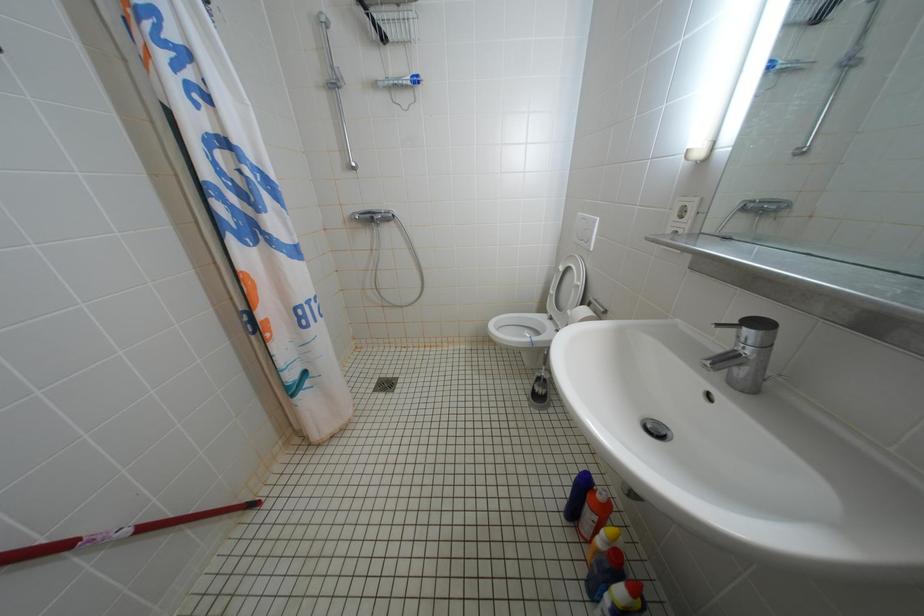
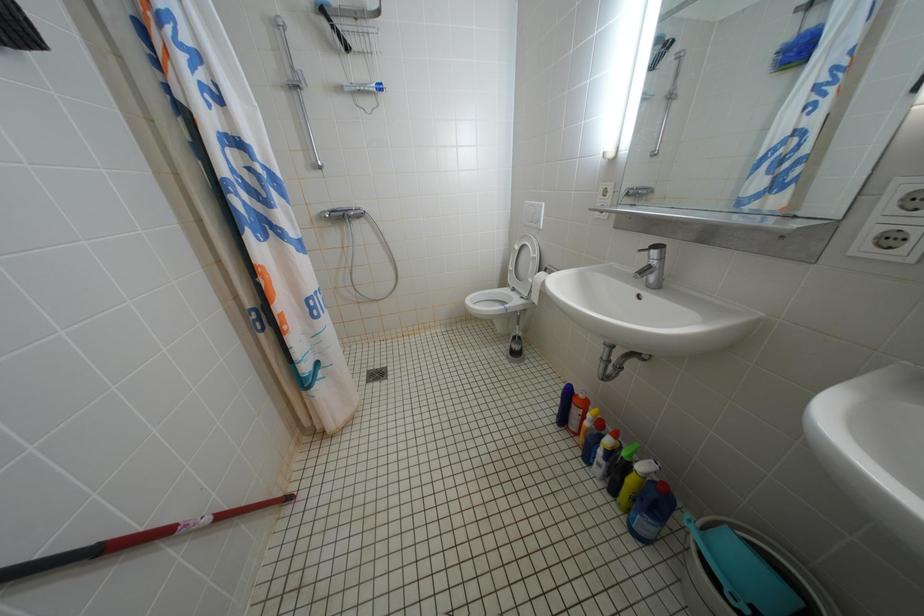
Question: The camera is either moving clockwise (left) or counter-clockwise (right) around the object. The first image is from the beginning of the video and the second image is from the end. Is the camera moving left or right when shooting the video?

Choices:
 (A) Left
 (B) Right

Answer: (A)